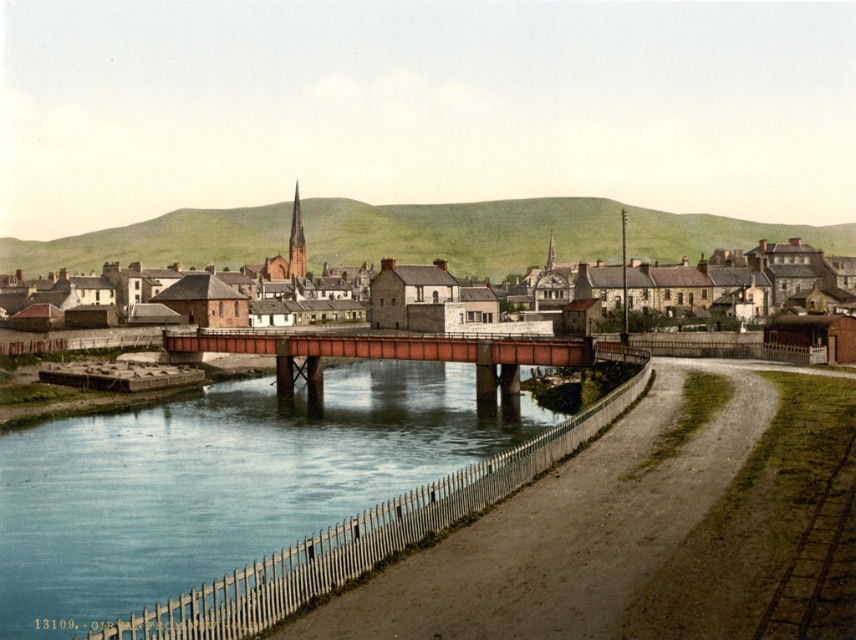
Question: Can you confirm if blue smooth water at center is positioned to the right of rusty metal bridge at center?

Choices:
 (A) no
 (B) yes

Answer: (B)

Question: Does blue smooth water at center appear under brown brick bridge at center?

Choices:
 (A) no
 (B) yes

Answer: (B)

Question: Can you confirm if blue smooth water at center is thinner than rusty metal bridge at center?

Choices:
 (A) yes
 (B) no

Answer: (A)

Question: Based on their relative distances, which object is nearer to the brown brick bridge at center?

Choices:
 (A) rusty metal bridge at center
 (B) blue smooth water at center

Answer: (A)

Question: Which point is farther to the camera?

Choices:
 (A) blue smooth water at center
 (B) brown brick bridge at center
 (C) rusty metal bridge at center

Answer: (B)

Question: Which point is farther to the camera?

Choices:
 (A) (262, 352)
 (B) (223, 547)

Answer: (A)